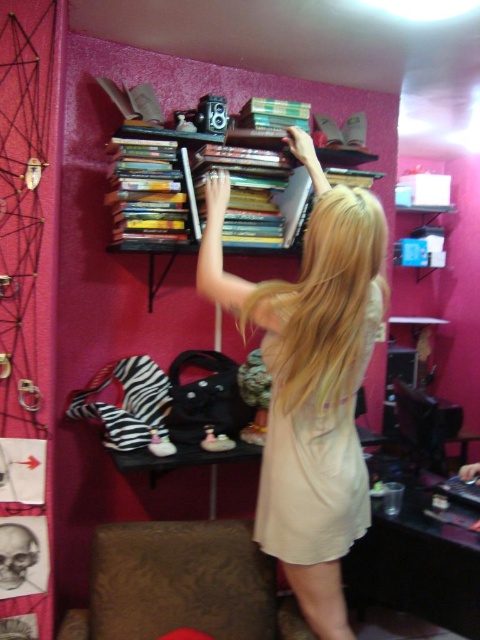
Question: Considering the relative positions of matte beige dress at center and brown textured couch at lower left in the image provided, where is matte beige dress at center located with respect to brown textured couch at lower left?

Choices:
 (A) left
 (B) right

Answer: (B)

Question: In this image, where is matte beige dress at center located relative to brown textured couch at lower left?

Choices:
 (A) right
 (B) left

Answer: (A)

Question: Is brown textured couch at lower left positioned in front of beige cotton dress at upper center?

Choices:
 (A) no
 (B) yes

Answer: (A)

Question: Estimate the real-world distances between objects in this image. Which object is farther from the beige cotton dress at upper center?

Choices:
 (A) matte beige dress at center
 (B) brown textured couch at lower left

Answer: (B)

Question: Which object is positioned farthest from the beige cotton dress at upper center?

Choices:
 (A) brown textured couch at lower left
 (B) matte beige dress at center

Answer: (A)

Question: Which point is farther to the camera?

Choices:
 (A) (152, 540)
 (B) (327, 406)
 (C) (319, 508)

Answer: (A)